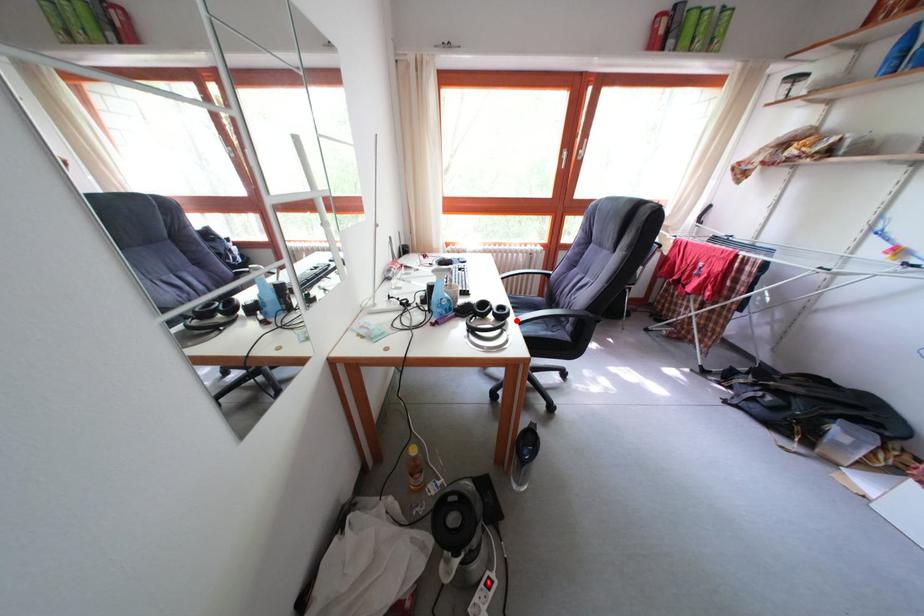
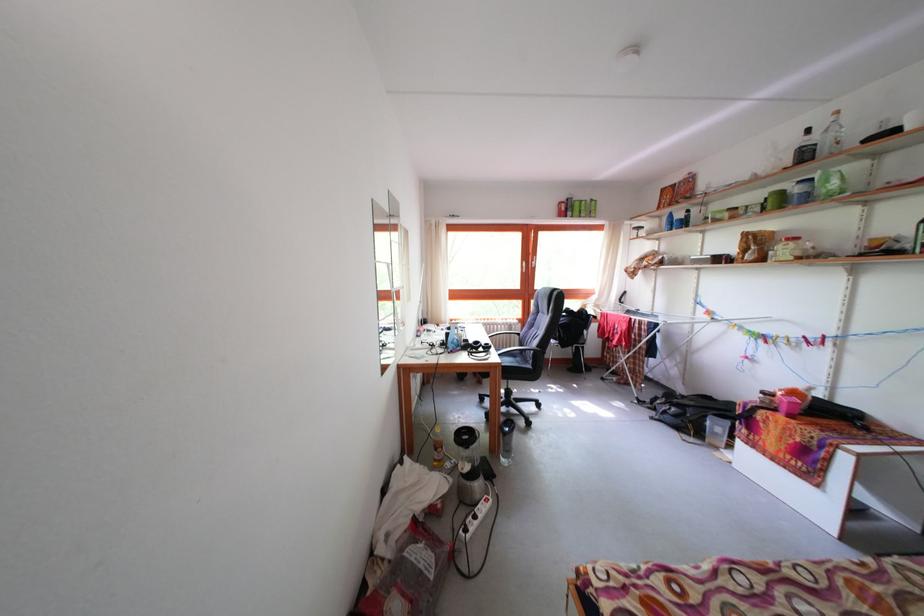
Find the pixel in the second image that matches the highlighted location in the first image.

(499, 354)